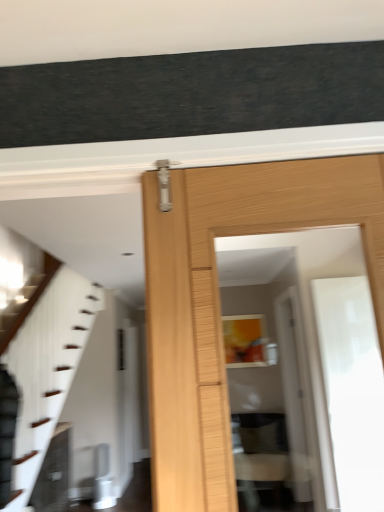
What do you see at coordinates (261, 455) in the screenshot?
I see `wooden table at center` at bounding box center [261, 455].

Identify the location of wooden table at center. (261, 455).

Measure the distance between point (279, 426) and camera.

Point (279, 426) is 4.66 meters away from camera.

Image resolution: width=384 pixels, height=512 pixels. I want to click on wooden table at center, so click(x=261, y=455).